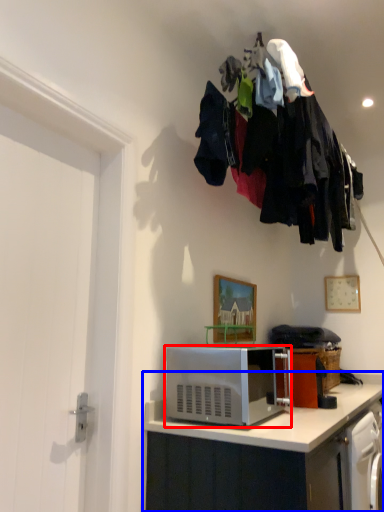
Question: Which of the following is the farthest to the observer, microwave oven (highlighted by a red box) or cabinetry (highlighted by a blue box)?

Choices:
 (A) microwave oven
 (B) cabinetry

Answer: (A)